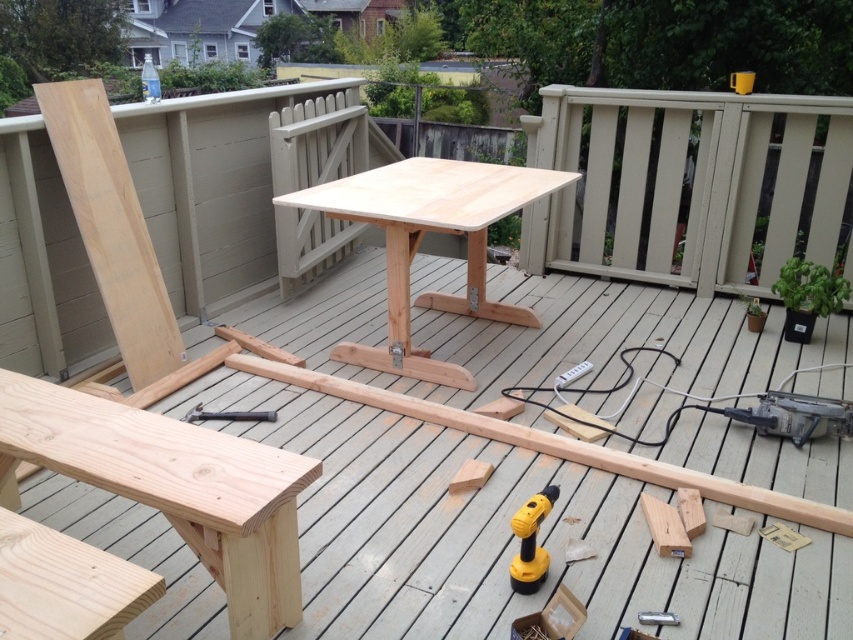
In the scene of a wooden deck under construction, you see a natural wood table at center and a yellow plastic drill at lower center. Which object is positioned to the left of the other?

The natural wood table at center is to the left of the yellow plastic drill at lower center.

You are standing on the deck and want to reach a point that is 1.62 meters away from you. Is the point at coordinates point [126,496] within your reach if your maximum reach is 1.5 meters?

The distance of point [126,496] from camera is 1.62 meters, so the point is beyond your maximum reach of 1.5 meters.

You are a contractor working on the deck and need to retrieve the yellow plastic drill at lower center. Which direction should you move from the natural wood table at center to reach it?

Since the natural wood table at center is located above the yellow plastic drill at lower center, you should move downward from the natural wood table at center to reach the yellow plastic drill at lower center.